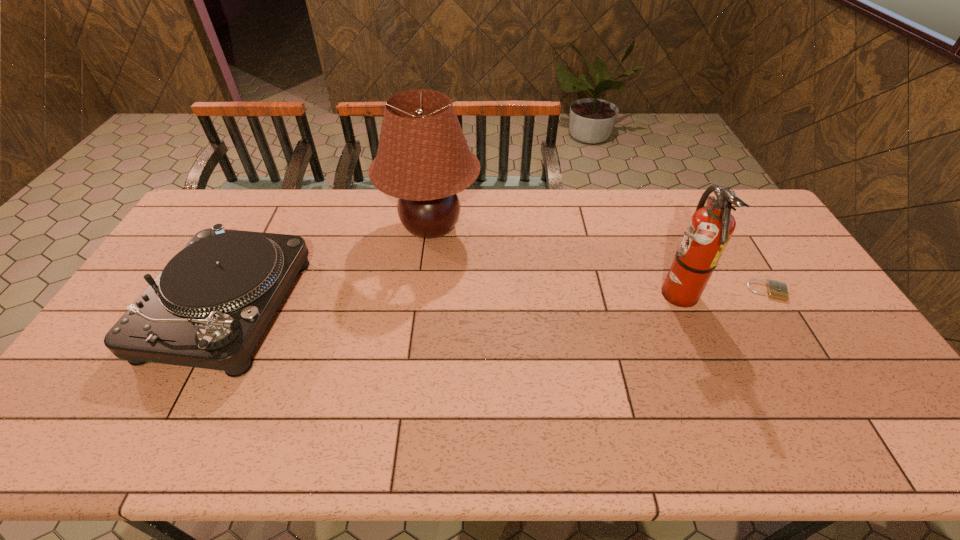
What are the coordinates of `free spot that satisfies the following two spatial constraints: 1. on the front-facing side of the third object from right to left; 2. on the left side of the rightmost object` in the screenshot? It's located at (423, 291).

Identify the location of free space that satisfies the following two spatial constraints: 1. from the nozzle of the second object from right to left; 2. on the front side of the leftmost object. This screenshot has height=540, width=960. (680, 308).